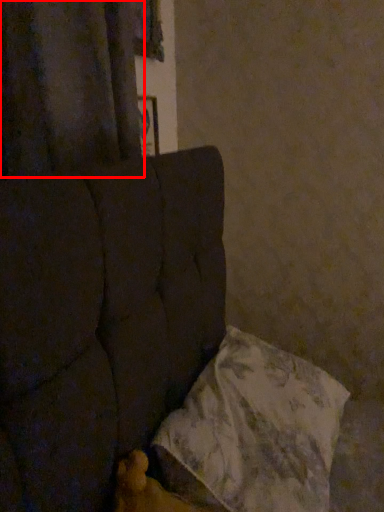
Question: From the image's perspective, where is curtain (annotated by the red box) located in relation to pillow in the image?

Choices:
 (A) above
 (B) below

Answer: (A)